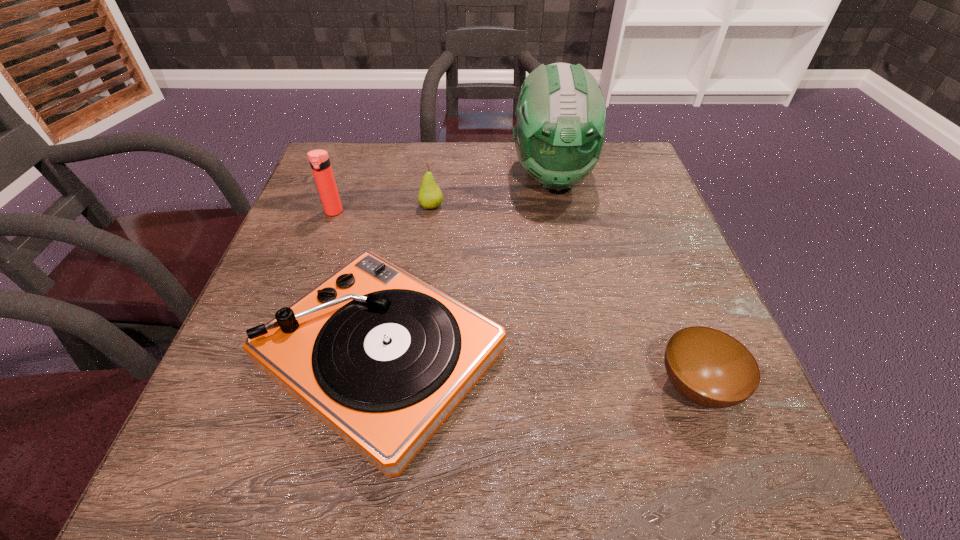
This screenshot has width=960, height=540. What are the coordinates of `object situated at the far edge` in the screenshot? It's located at (559, 135).

The height and width of the screenshot is (540, 960). What are the coordinates of `object that is at the near edge` in the screenshot? It's located at (382, 358).

Find the location of a particular element. thermos bottle that is at the left edge is located at coordinates (319, 160).

You are a GUI agent. You are given a task and a screenshot of the screen. Output one action in this format:
    pyautogui.click(x=<x>, y=<y>)
    Task: Click on the record player that is at the left edge
    The height and width of the screenshot is (540, 960).
    Given the screenshot: What is the action you would take?
    pyautogui.click(x=382, y=358)

The height and width of the screenshot is (540, 960). What are the coordinates of `football helmet that is at the right edge` in the screenshot? It's located at (559, 135).

At what (x,y) coordinates should I click in order to perform the action: click on bowl situated at the right edge. Please return your answer as a coordinate pair (x, y). The height and width of the screenshot is (540, 960). Looking at the image, I should click on (708, 367).

Locate an element on the screen. The image size is (960, 540). object that is at the near left corner is located at coordinates (382, 358).

This screenshot has width=960, height=540. Find the location of `object that is at the far right corner`. object that is at the far right corner is located at coordinates (559, 135).

This screenshot has height=540, width=960. In order to click on free space at the far edge of the desktop in this screenshot , I will do `click(392, 154)`.

In the image, there is a desktop. At what (x,y) coordinates should I click in order to perform the action: click on vacant space at the near edge. Please return your answer as a coordinate pair (x, y). Looking at the image, I should click on (493, 479).